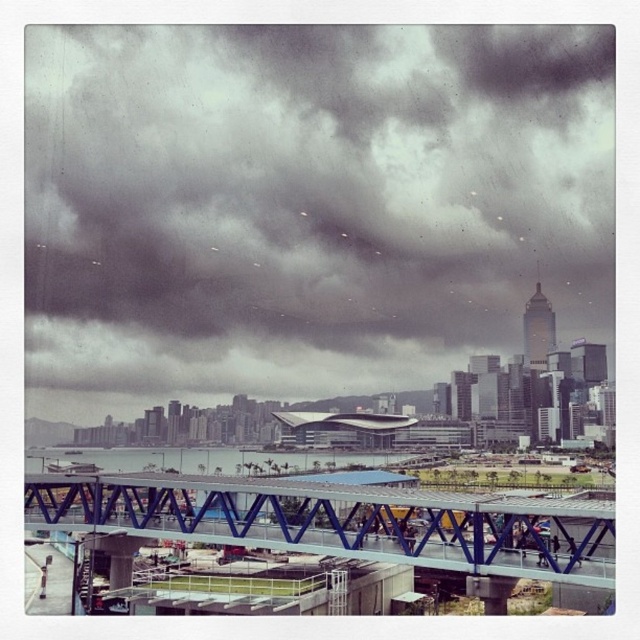
You are an architect observing the urban landscape. You need to determine the relative positions of the dark gray cloud at upper center and the blue metallic bridge at center. Which object is positioned to the right when viewed from your perspective?

The dark gray cloud at upper center is positioned to the right of the blue metallic bridge at center.

You are standing at the point marked by point (340, 522). What object are you directly facing in the image?

You are directly facing the blue metallic bridge at center as marked by point (340, 522).

You are a drone operator who needs to fly a drone from your current position to capture the dark gray cloud at upper center. If your drone has a maximum flight range of 600 feet, will it be able to reach the cloud?

The dark gray cloud at upper center and the viewer are 616.95 feet apart. Since the drone can only fly up to 600 feet, it will not be able to reach the cloud.